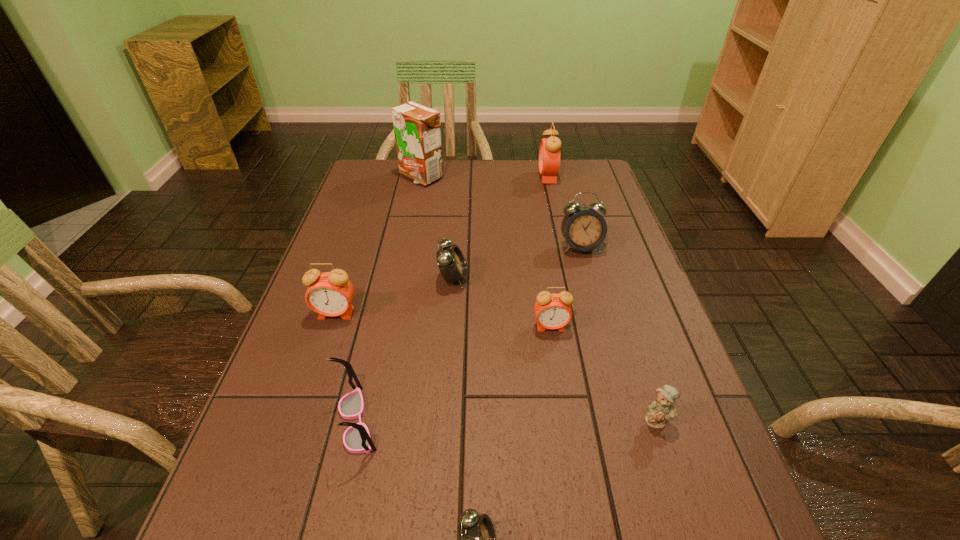
The height and width of the screenshot is (540, 960). Find the location of `free space located 0.200m on the face of the smallest pink alarm clock`. free space located 0.200m on the face of the smallest pink alarm clock is located at coordinates (564, 414).

Identify the location of vacant region located on the back of the pink spectacles. (377, 335).

The height and width of the screenshot is (540, 960). What are the coordinates of `vacant area located on the front-facing side of the blue teddy bear` in the screenshot? It's located at (689, 518).

Image resolution: width=960 pixels, height=540 pixels. Find the location of `carton at the far edge`. carton at the far edge is located at coordinates (417, 128).

You are a GUI agent. You are given a task and a screenshot of the screen. Output one action in this format:
    pyautogui.click(x=<x>, y=<y>)
    Task: Click on the alarm clock located at the far edge
    This screenshot has height=540, width=960.
    Given the screenshot: What is the action you would take?
    pyautogui.click(x=549, y=153)

The width and height of the screenshot is (960, 540). I want to click on carton situated at the left edge, so click(x=417, y=128).

I want to click on alarm clock located at the left edge, so click(330, 294).

This screenshot has width=960, height=540. I want to click on spectacles present at the left edge, so click(357, 439).

What are the coordinates of `alarm clock that is at the right edge` in the screenshot? It's located at (584, 229).

Where is `teddy bear that is at the right edge`? The image size is (960, 540). teddy bear that is at the right edge is located at coordinates (660, 410).